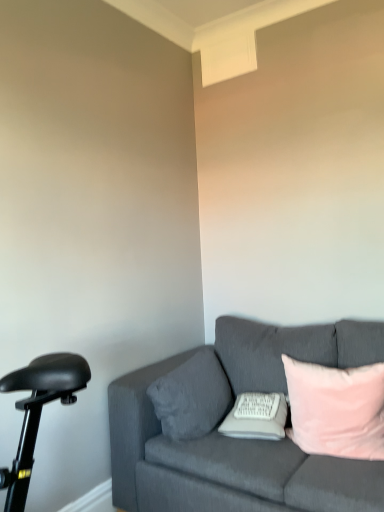
Measure the distance between point (315, 503) and camera.

4.55 feet.

The width and height of the screenshot is (384, 512). What do you see at coordinates (192, 397) in the screenshot? I see `velvet gray pillow at center, the third pillow positioned from the right` at bounding box center [192, 397].

Describe the element at coordinates (257, 417) in the screenshot. This screenshot has height=512, width=384. I see `white soft pillow at center, which ranks as the 2th pillow in left-to-right order` at that location.

Where is `velvet gray couch at right`? velvet gray couch at right is located at coordinates (222, 463).

Does velvet gray couch at right appear on the right side of velvet gray pillow at center, the third pillow positioned from the right?

Correct, you'll find velvet gray couch at right to the right of velvet gray pillow at center, the third pillow positioned from the right.

From the picture: From a real-world perspective, is velvet gray couch at right positioned above or below velvet gray pillow at center, positioned as the 1th pillow in left-to-right order?

velvet gray couch at right is below velvet gray pillow at center, positioned as the 1th pillow in left-to-right order.

Does point (204, 462) come in front of point (188, 376)?

Yes, it is.

Is velvet gray couch at right inside or outside of velvet gray pillow at center, the third pillow positioned from the right?

velvet gray couch at right is not enclosed by velvet gray pillow at center, the third pillow positioned from the right.

Is velvet gray pillow at center, the third pillow positioned from the right, not near white soft pillow at center, the 2th pillow viewed from the right?

No, velvet gray pillow at center, the third pillow positioned from the right, is not far from white soft pillow at center, the 2th pillow viewed from the right.

Can you tell me how much velvet gray pillow at center, the third pillow positioned from the right, and white soft pillow at center, the 2th pillow viewed from the right, differ in facing direction?

75.9 degrees.

Between velvet gray pillow at center, positioned as the 1th pillow in left-to-right order, and white soft pillow at center, which ranks as the 2th pillow in left-to-right order, which one appears on the left side from the viewer's perspective?

Positioned to the left is velvet gray pillow at center, positioned as the 1th pillow in left-to-right order.

You are a GUI agent. You are given a task and a screenshot of the screen. Output one action in this format:
    pyautogui.click(x=<x>, y=<y>)
    Task: Click on the 1st pillow counting from the right of the velvet gray pillow at center, positioned as the 1th pillow in left-to-right order
    
    Given the screenshot: What is the action you would take?
    pyautogui.click(x=257, y=417)

Considering the relative positions of pink velvet pillow at right, which ranks as the third pillow in left-to-right order, and velvet gray couch at right in the image provided, is pink velvet pillow at right, which ranks as the third pillow in left-to-right order, to the right of velvet gray couch at right from the viewer's perspective?

Indeed, pink velvet pillow at right, which ranks as the third pillow in left-to-right order, is positioned on the right side of velvet gray couch at right.

Which of these two, pink velvet pillow at right, the 1th pillow when ordered from right to left, or velvet gray couch at right, stands shorter?

With less height is pink velvet pillow at right, the 1th pillow when ordered from right to left.

The image size is (384, 512). I want to click on studio couch that appears on the left of pink velvet pillow at right, which ranks as the third pillow in left-to-right order, so click(222, 463).

How many degrees apart are the facing directions of pink velvet pillow at right, the 1th pillow when ordered from right to left, and velvet gray couch at right?

They differ by 2.79 degrees in their facing directions.

How different are the orientations of white soft pillow at center, which ranks as the 2th pillow in left-to-right order, and velvet gray couch at right in degrees?

The angle between the facing direction of white soft pillow at center, which ranks as the 2th pillow in left-to-right order, and the facing direction of velvet gray couch at right is 14.1 degrees.

Is white soft pillow at center, the 2th pillow viewed from the right, placed right next to velvet gray couch at right?

No, white soft pillow at center, the 2th pillow viewed from the right, is not touching velvet gray couch at right.

Is white soft pillow at center, which ranks as the 2th pillow in left-to-right order, oriented towards velvet gray couch at right?

Yes, white soft pillow at center, which ranks as the 2th pillow in left-to-right order, is aimed at velvet gray couch at right.

Can you confirm if white soft pillow at center, which ranks as the 2th pillow in left-to-right order, is wider than velvet gray couch at right?

Incorrect, the width of white soft pillow at center, which ranks as the 2th pillow in left-to-right order, does not surpass that of velvet gray couch at right.

Between pink velvet pillow at right, which ranks as the third pillow in left-to-right order, and velvet gray pillow at center, positioned as the 1th pillow in left-to-right order, which one has smaller size?

With smaller size is velvet gray pillow at center, positioned as the 1th pillow in left-to-right order.

Would you say pink velvet pillow at right, which ranks as the third pillow in left-to-right order, is inside or outside velvet gray pillow at center, positioned as the 1th pillow in left-to-right order?

pink velvet pillow at right, which ranks as the third pillow in left-to-right order, exists outside the volume of velvet gray pillow at center, positioned as the 1th pillow in left-to-right order.

This screenshot has height=512, width=384. In order to click on the 2nd pillow counting from the right side of the velvet gray pillow at center, the third pillow positioned from the right in this screenshot , I will do `click(336, 409)`.

Can you confirm if pink velvet pillow at right, the 1th pillow when ordered from right to left, is taller than velvet gray pillow at center, the third pillow positioned from the right?

Yes.

Is pink velvet pillow at right, the 1th pillow when ordered from right to left, beside white soft pillow at center, which ranks as the 2th pillow in left-to-right order?

No, pink velvet pillow at right, the 1th pillow when ordered from right to left, is not making contact with white soft pillow at center, which ranks as the 2th pillow in left-to-right order.

Is point (369, 413) positioned in front of point (224, 421)?

Yes.

Between pink velvet pillow at right, the 1th pillow when ordered from right to left, and white soft pillow at center, which ranks as the 2th pillow in left-to-right order, which one appears on the right side from the viewer's perspective?

Positioned to the right is pink velvet pillow at right, the 1th pillow when ordered from right to left.

Based on the photo, is pink velvet pillow at right, the 1th pillow when ordered from right to left, not within white soft pillow at center, which ranks as the 2th pillow in left-to-right order?

Indeed, pink velvet pillow at right, the 1th pillow when ordered from right to left, is completely outside white soft pillow at center, which ranks as the 2th pillow in left-to-right order.

From the picture: Could you tell me if velvet gray couch at right is facing white soft pillow at center, which ranks as the 2th pillow in left-to-right order?

Yes, velvet gray couch at right is facing white soft pillow at center, which ranks as the 2th pillow in left-to-right order.

Which object is positioned more to the right, velvet gray couch at right or white soft pillow at center, which ranks as the 2th pillow in left-to-right order?

velvet gray couch at right.

How many degrees apart are the facing directions of velvet gray couch at right and white soft pillow at center, the 2th pillow viewed from the right?

velvet gray couch at right and white soft pillow at center, the 2th pillow viewed from the right, are facing 14.1 degrees away from each other.

From a real-world perspective, is velvet gray couch at right physically below white soft pillow at center, the 2th pillow viewed from the right?

Yes, from a real-world perspective, velvet gray couch at right is under white soft pillow at center, the 2th pillow viewed from the right.

Image resolution: width=384 pixels, height=512 pixels. Find the location of `studio couch in front of the velvet gray pillow at center, positioned as the 1th pillow in left-to-right order`. studio couch in front of the velvet gray pillow at center, positioned as the 1th pillow in left-to-right order is located at coordinates (222, 463).

At what (x,y) coordinates should I click in order to perform the action: click on pillow behind the white soft pillow at center, which ranks as the 2th pillow in left-to-right order. Please return your answer as a coordinate pair (x, y). The width and height of the screenshot is (384, 512). Looking at the image, I should click on coord(192,397).

Based on their spatial positions, is pink velvet pillow at right, which ranks as the third pillow in left-to-right order, or velvet gray pillow at center, positioned as the 1th pillow in left-to-right order, further from velvet gray couch at right?

pink velvet pillow at right, which ranks as the third pillow in left-to-right order.

Based on their spatial positions, is pink velvet pillow at right, the 1th pillow when ordered from right to left, or velvet gray couch at right closer to white soft pillow at center, which ranks as the 2th pillow in left-to-right order?

Based on the image, velvet gray couch at right appears to be nearer to white soft pillow at center, which ranks as the 2th pillow in left-to-right order.

Looking at the image, which one is located further to pink velvet pillow at right, the 1th pillow when ordered from right to left, velvet gray couch at right or white soft pillow at center, the 2th pillow viewed from the right?

The object further to pink velvet pillow at right, the 1th pillow when ordered from right to left, is velvet gray couch at right.

In the scene shown: Looking at the image, which one is located further to pink velvet pillow at right, the 1th pillow when ordered from right to left, white soft pillow at center, which ranks as the 2th pillow in left-to-right order, or velvet gray pillow at center, positioned as the 1th pillow in left-to-right order?

velvet gray pillow at center, positioned as the 1th pillow in left-to-right order.

Based on their spatial positions, is white soft pillow at center, the 2th pillow viewed from the right, or velvet gray couch at right further from velvet gray pillow at center, positioned as the 1th pillow in left-to-right order?

white soft pillow at center, the 2th pillow viewed from the right, is further to velvet gray pillow at center, positioned as the 1th pillow in left-to-right order.

Which object lies further to the anchor point pink velvet pillow at right, the 1th pillow when ordered from right to left, velvet gray pillow at center, positioned as the 1th pillow in left-to-right order, or velvet gray couch at right?

Based on the image, velvet gray pillow at center, positioned as the 1th pillow in left-to-right order, appears to be further to pink velvet pillow at right, the 1th pillow when ordered from right to left.

Looking at the image, which one is located further to velvet gray pillow at center, the third pillow positioned from the right, pink velvet pillow at right, which ranks as the third pillow in left-to-right order, or white soft pillow at center, which ranks as the 2th pillow in left-to-right order?

pink velvet pillow at right, which ranks as the third pillow in left-to-right order, is further to velvet gray pillow at center, the third pillow positioned from the right.

Which object lies nearer to the anchor point velvet gray couch at right, velvet gray pillow at center, positioned as the 1th pillow in left-to-right order, or pink velvet pillow at right, which ranks as the third pillow in left-to-right order?

Among the two, velvet gray pillow at center, positioned as the 1th pillow in left-to-right order, is located nearer to velvet gray couch at right.

The width and height of the screenshot is (384, 512). I want to click on studio couch situated between velvet gray pillow at center, the third pillow positioned from the right, and pink velvet pillow at right, the 1th pillow when ordered from right to left, from left to right, so click(222, 463).

This screenshot has width=384, height=512. I want to click on pillow between velvet gray pillow at center, positioned as the 1th pillow in left-to-right order, and pink velvet pillow at right, the 1th pillow when ordered from right to left, from left to right, so click(257, 417).

What are the coordinates of `pillow between velvet gray couch at right and white soft pillow at center, the 2th pillow viewed from the right, along the z-axis` in the screenshot? It's located at (336, 409).